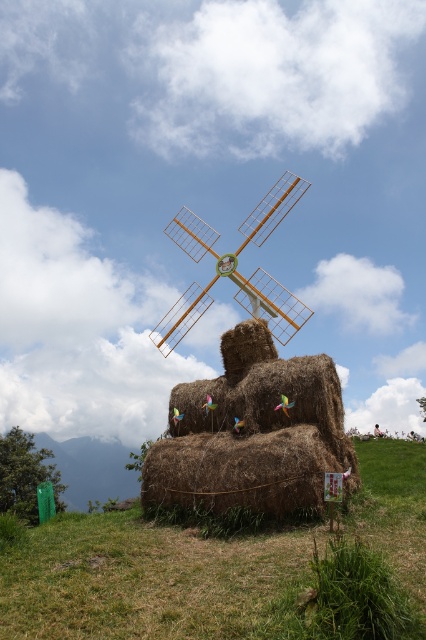
Is point (252, 580) in front of point (290, 182)?

Yes, it is.

Who is taller, brown grassy at center or wooden windmill at center?

wooden windmill at center

What do you see at coordinates (152, 579) in the screenshot? The height and width of the screenshot is (640, 426). I see `brown grassy at center` at bounding box center [152, 579].

Find the location of a particular element. brown grassy at center is located at coordinates (152, 579).